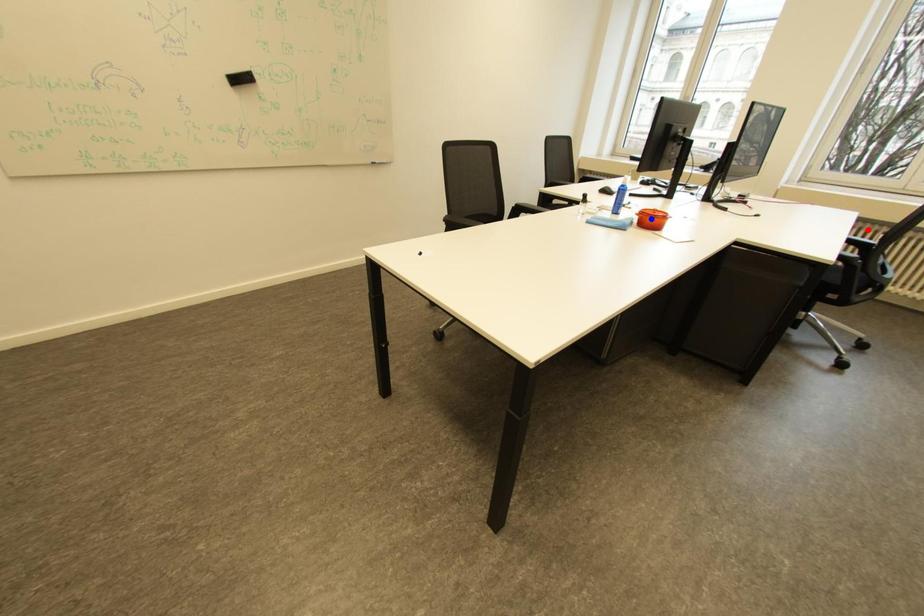
Question: Which of the two points in the image is closer to the camera?

Choices:
 (A) Blue point is closer.
 (B) Red point is closer.

Answer: (A)